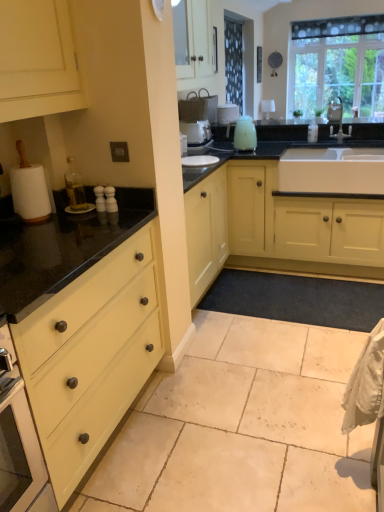
Question: In terms of width, does matte yellow drawer at left look wider or thinner when compared to matte yellow cabinet at center?

Choices:
 (A) thin
 (B) wide

Answer: (A)

Question: Is matte yellow drawer at left in front of or behind matte yellow cabinet at center in the image?

Choices:
 (A) front
 (B) behind

Answer: (A)

Question: Estimate the real-world distances between objects in this image. Which object is farther from the beige tile floor at lower center?

Choices:
 (A) white ceramic sink at center
 (B) matte yellow drawer at left
 (C) matte yellow cabinet at center
 (D) transparent glass window at upper right
 (E) satin nickel faucet at upper right

Answer: (D)

Question: Based on their relative distances, which object is nearer to the transparent glass window at upper right?

Choices:
 (A) matte yellow drawer at left
 (B) beige tile floor at lower center
 (C) matte yellow cabinet at center
 (D) white ceramic sink at center
 (E) satin nickel faucet at upper right

Answer: (E)